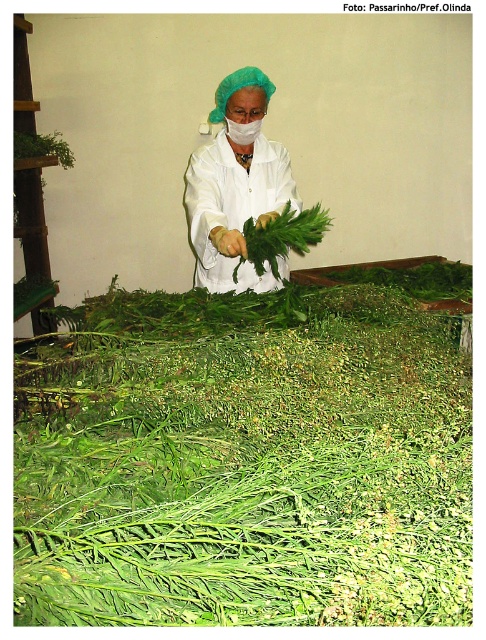
Question: Is green leafy grass at center further to the viewer compared to white matte lab coat at center?

Choices:
 (A) no
 (B) yes

Answer: (A)

Question: Is green leafy grass at center above white matte lab coat at center?

Choices:
 (A) no
 (B) yes

Answer: (A)

Question: Can you confirm if green leafy grass at center is positioned above white matte lab coat at center?

Choices:
 (A) no
 (B) yes

Answer: (A)

Question: Which point is farther from the camera taking this photo?

Choices:
 (A) (235, 99)
 (B) (200, 356)

Answer: (A)